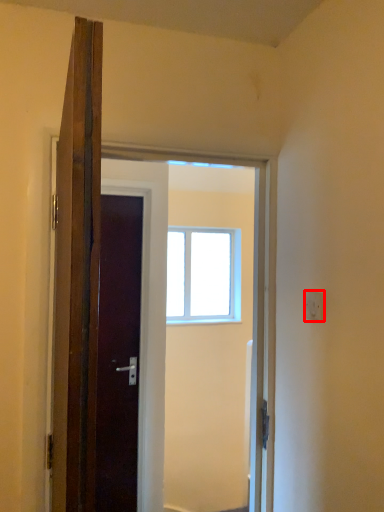
Question: From the image's perspective, where is electric outlet (annotated by the red box) located in relation to window in the image?

Choices:
 (A) above
 (B) below

Answer: (A)